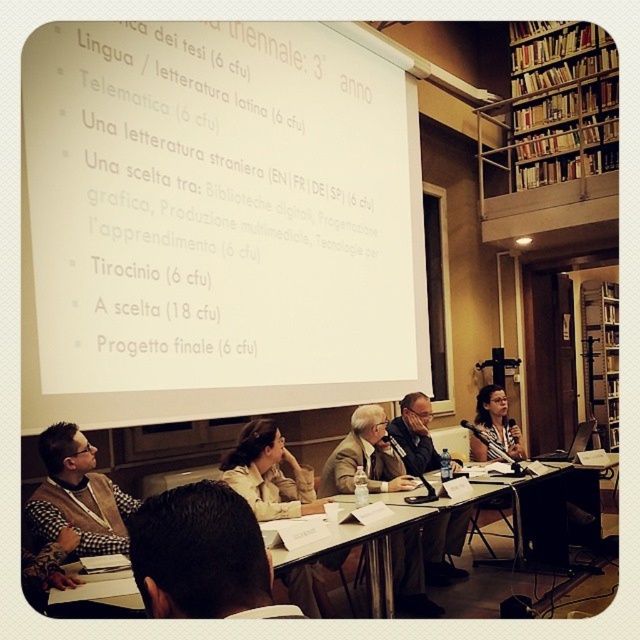
Consider the image. You are a guest attending a university lecture and notice the brown leather jacket at lower center and the wooden bookshelf at right. Which object is taller?

The wooden bookshelf at right is taller than the brown leather jacket at lower center.

You are sitting at the back of the room and want to hand a document to the person wearing the brown leather jacket at lower center and the person wearing the matte black shirt at lower right. Which person should you approach first to reach them without walking past the other?

You should approach the brown leather jacket at lower center first because it is closer to you than the matte black shirt at lower right, so you can reach them without needing to walk past the other person.

You are organizing a photo shoot and need to place a 1.2 meter wide backdrop between the brown leather jacket at lower center and the matte black shirt at lower right. Can the backdrop fit between them?

The brown leather jacket at lower center has a lesser width compared to matte black shirt at lower right. Since the backdrop is 1.2 meters wide, but the exact distance between the two objects isn not provided, it is impossible to determine if the backdrop would fit without additional information about their separation.